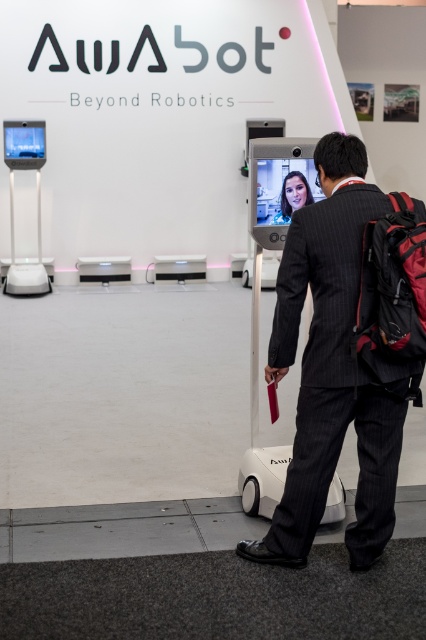
Between point (311, 289) and point (302, 193), which one is positioned behind?

The point (302, 193) is more distant.

Image resolution: width=426 pixels, height=640 pixels. I want to click on dark gray pinstripe suit at center, so click(x=333, y=369).